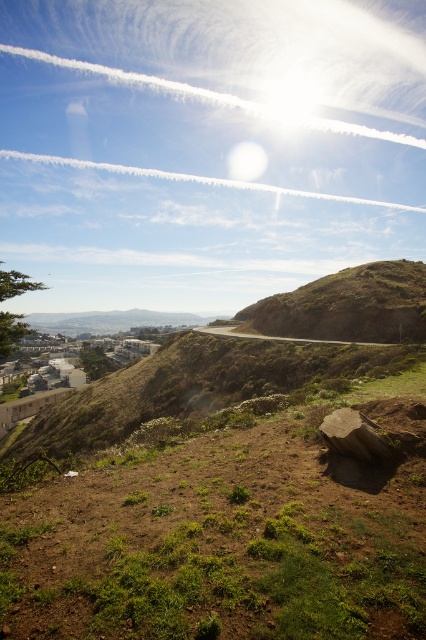
You are standing at the base of the sloping hillside in the scenic outdoor landscape. You see two points marked on the image. Which point is closer to you, point (157, 460) or point (325, 278)?

Point (157, 460) is in front of point (325, 278), so it is closer to you.

You are standing at the bottom of the hill and looking up. There is a green grassy area at center. Where is the green grassy at center located relative to your position?

The green grassy at center is located at the center of the image, which would be directly in front of you as you look up the slope from the bottom of the hill.